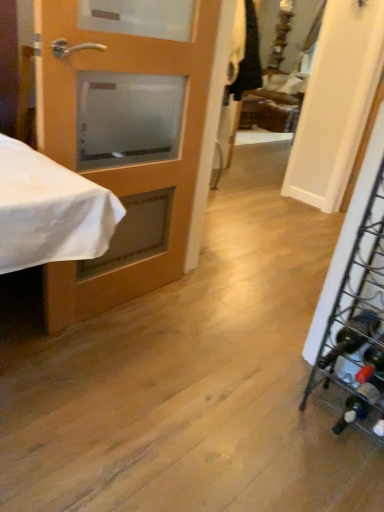
Locate an element on the screen. The image size is (384, 512). vacant space that is in between metallic wire wine rack at right and matte wood door at left is located at coordinates (209, 352).